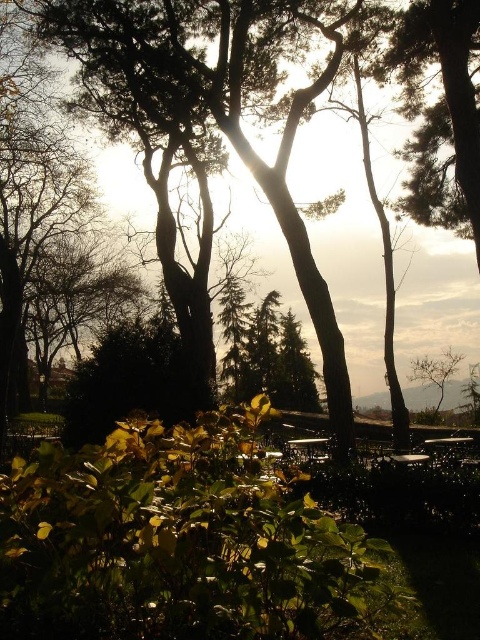
Question: Does green leafy bush at lower center have a larger size compared to bare branches at right?

Choices:
 (A) no
 (B) yes

Answer: (B)

Question: From the image, what is the correct spatial relationship of green leafy bush at lower center in relation to bare branches at right?

Choices:
 (A) above
 (B) below

Answer: (A)

Question: Which object appears closest to the camera in this image?

Choices:
 (A) green leafy bush at lower center
 (B) bare branches at right

Answer: (A)

Question: Among these objects, which one is farthest from the camera?

Choices:
 (A) green leafy bush at lower center
 (B) bare branches at right

Answer: (B)

Question: Can you confirm if green leafy bush at lower center is positioned to the right of bare branches at right?

Choices:
 (A) yes
 (B) no

Answer: (B)